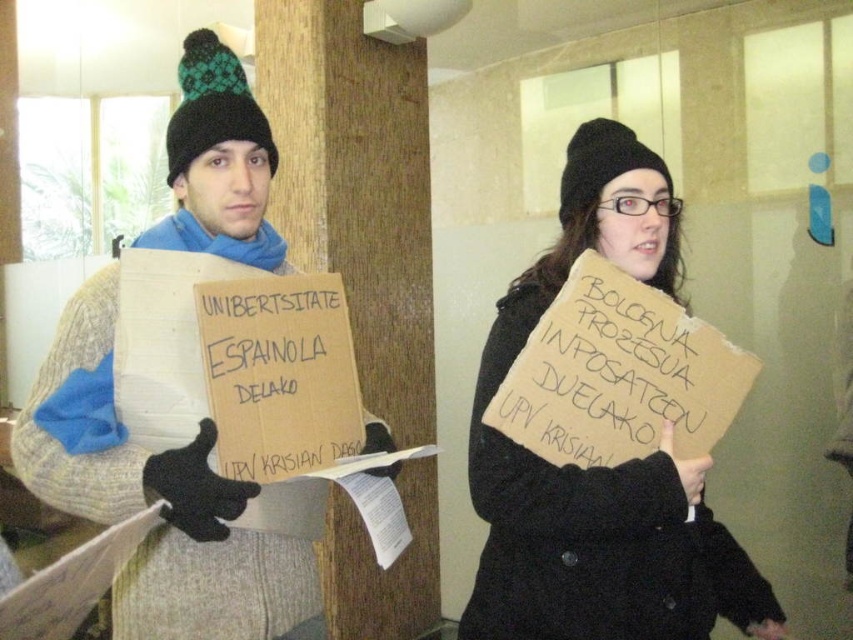
You are a delivery robot navigating a hallway. You need to deliver a package to the point at coordinates point (283,586). There is an obstacle at point (608,508). Can you reach the destination without passing through the obstacle?

Point (608,508) is in front of point (283,586), so the obstacle is blocking the path to the destination. You cannot reach the destination without passing through the obstacle.

You are trying to determine if the matte cardboard sign at center can fit into a display case that is the same width as the knitted wool hat at upper left. Can it fit?

The matte cardboard sign at center might be wider than knitted wool hat at upper left, so it might not fit into the display case.